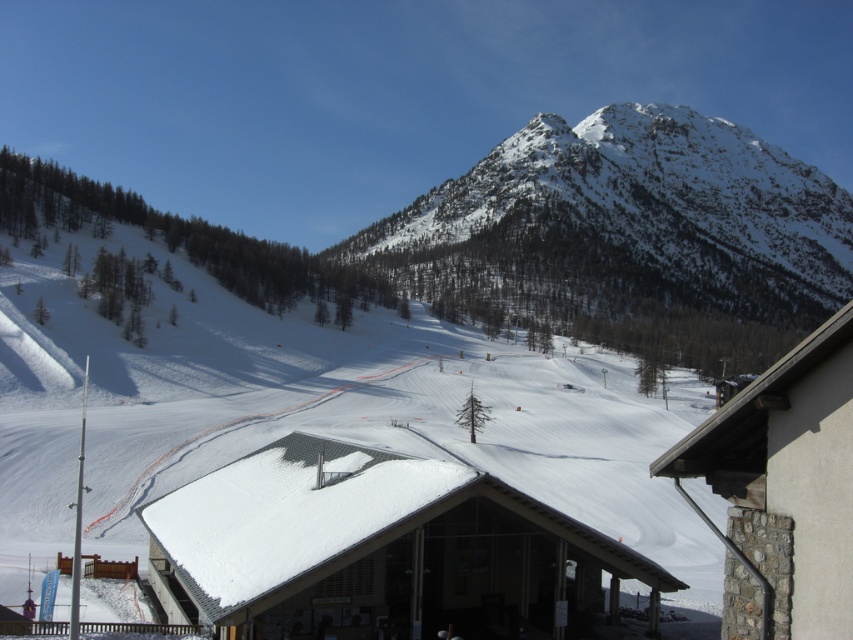
Can you confirm if snowy rocky mountain at upper center is positioned to the right of white shingled roof at center?

Correct, you'll find snowy rocky mountain at upper center to the right of white shingled roof at center.

Does point (532, 273) lie in front of point (299, 628)?

That is False.

What are the coordinates of `snowy rocky mountain at upper center` in the screenshot? It's located at (628, 220).

Identify the location of snowy rocky mountain at upper center. This screenshot has width=853, height=640. (628, 220).